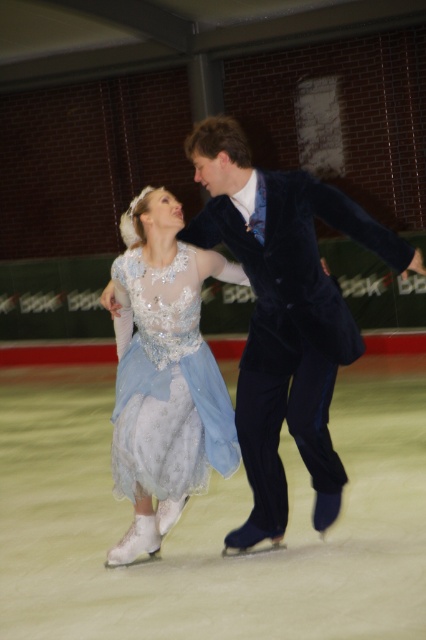
You are a photographer capturing the figure skating performance. You notice the shiny white skates at center and the light blue satin dress at center. Which object appears shorter in the photo?

The shiny white skates at center appear shorter than the light blue satin dress at center.

You are a photographer at the event and want to capture both the light blue satin dress at center and the satin blue dress at center in the same frame. Which dress should you focus on first to ensure both are in the frame?

The light blue satin dress at center might be wider than the satin blue dress at center, so focusing on the light blue satin dress at center first would ensure both are in the frame.